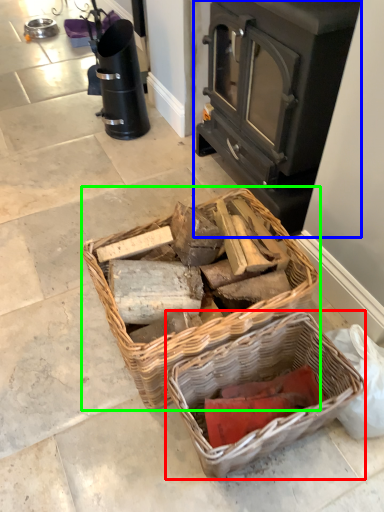
Question: Which object is positioned farthest from picnic basket (highlighted by a red box)? Select from wood burning stove (highlighted by a blue box) and picnic basket (highlighted by a green box).

Choices:
 (A) wood burning stove
 (B) picnic basket

Answer: (A)